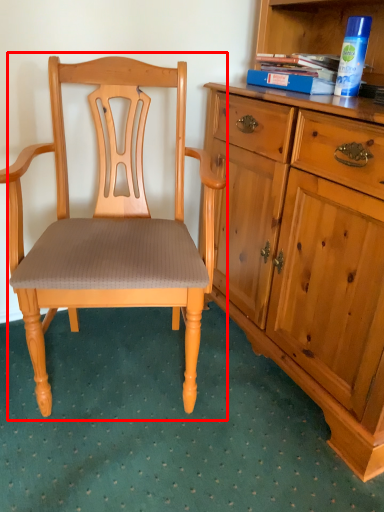
Question: From the image, what is the correct spatial relationship of chair (annotated by the red box) in relation to book?

Choices:
 (A) right
 (B) left

Answer: (B)